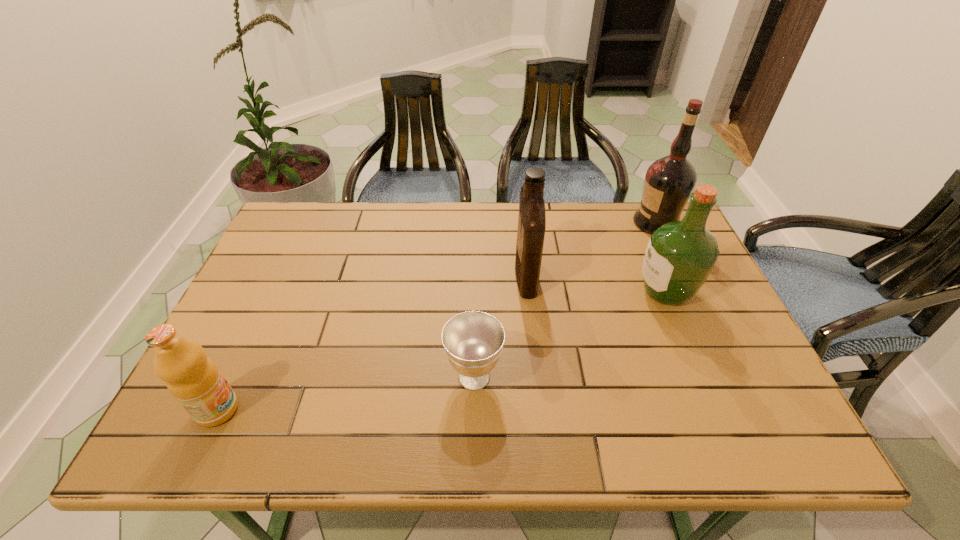
Identify the location of the farthest object. The image size is (960, 540). (669, 181).

Find the location of `the tallest object`. the tallest object is located at coordinates (669, 181).

You are a GUI agent. You are given a task and a screenshot of the screen. Output one action in this format:
    pyautogui.click(x=<x>, y=<y>)
    Task: Click on the third object from left to right
    
    Given the screenshot: What is the action you would take?
    pyautogui.click(x=532, y=217)

Locate an element on the screen. fruit juice is located at coordinates (195, 381).

Locate an element on the screen. the second shortest object is located at coordinates (195, 381).

Locate an element on the screen. This screenshot has height=540, width=960. the shortest object is located at coordinates (473, 341).

Where is `the fourth object from right to left`? Image resolution: width=960 pixels, height=540 pixels. the fourth object from right to left is located at coordinates (473, 341).

Locate an element on the screen. vacant space located on the surface of the tallest object is located at coordinates (548, 223).

This screenshot has height=540, width=960. Find the location of `free space located on the surface of the tallest object`. free space located on the surface of the tallest object is located at coordinates (612, 223).

The width and height of the screenshot is (960, 540). What are the coordinates of `free spot located 0.370m on the surface of the tallest object` in the screenshot? It's located at (517, 223).